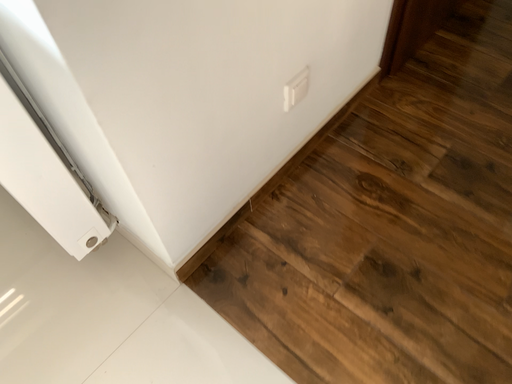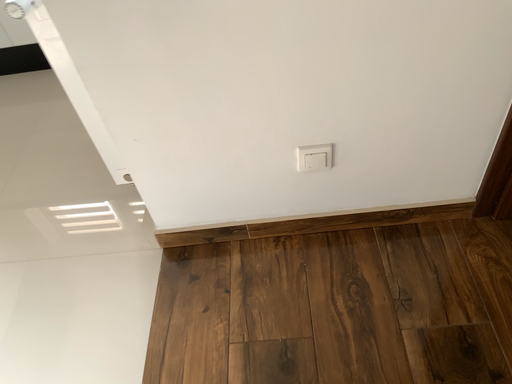
Question: How did the camera likely rotate when shooting the video?

Choices:
 (A) rotated downward
 (B) rotated upward

Answer: (B)